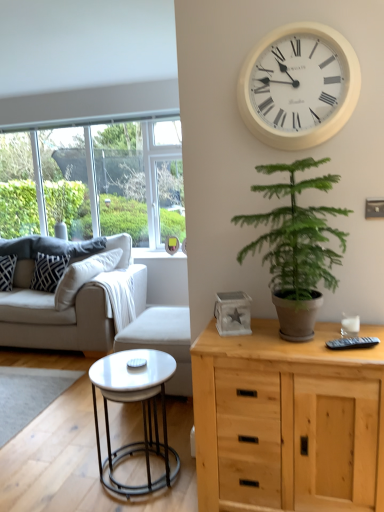
Where is `free space above natural wood cabinet at right (from a real-world perspective)`? The height and width of the screenshot is (512, 384). free space above natural wood cabinet at right (from a real-world perspective) is located at coordinates (288, 340).